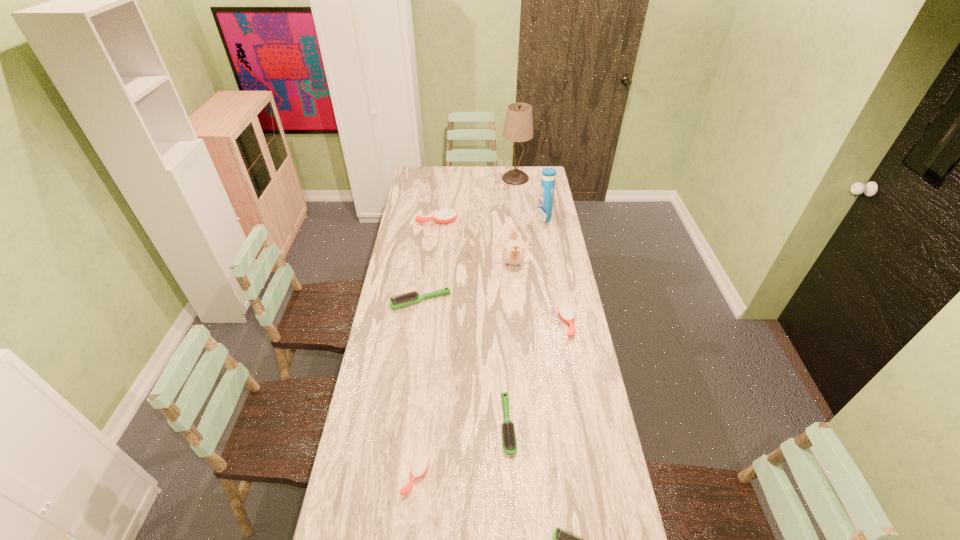
Locate an element on the screen. vacant space located on the back of the farthest orange hairbrush is located at coordinates (442, 186).

Locate an element on the screen. Image resolution: width=960 pixels, height=540 pixels. free point located on the left of the second nearest orange hairbrush is located at coordinates (464, 323).

Locate an element on the screen. The image size is (960, 540). vacant space situated on the right of the farthest light hairbrush is located at coordinates (493, 301).

Where is `vacant space located on the back of the second light hairbrush from left to right`? The height and width of the screenshot is (540, 960). vacant space located on the back of the second light hairbrush from left to right is located at coordinates (505, 360).

The width and height of the screenshot is (960, 540). Identify the location of vacant point located 0.160m on the right of the smallest orange hairbrush. (480, 477).

At what (x,y) coordinates should I click in order to perform the action: click on object that is at the far edge. Please return your answer as a coordinate pair (x, y). This screenshot has height=540, width=960. Looking at the image, I should click on (518, 127).

Identify the location of lampshade located at the right edge. The height and width of the screenshot is (540, 960). (518, 127).

This screenshot has width=960, height=540. I want to click on detergent at the right edge, so click(545, 202).

I want to click on bird situated at the right edge, so click(x=513, y=252).

Locate an element on the screen. hairbrush that is at the right edge is located at coordinates (566, 312).